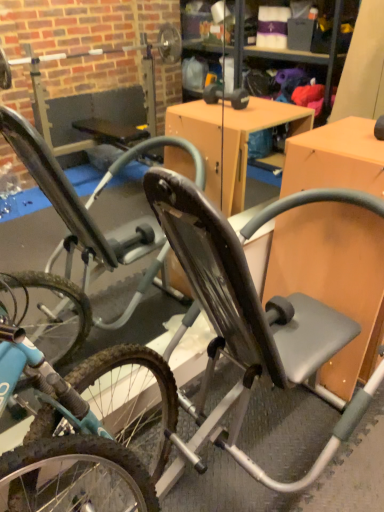
The image size is (384, 512). I want to click on matte orange table at center, so click(334, 278).

What do you see at coordinates (334, 278) in the screenshot? I see `matte orange table at center` at bounding box center [334, 278].

Image resolution: width=384 pixels, height=512 pixels. I want to click on matte orange table at center, so click(334, 278).